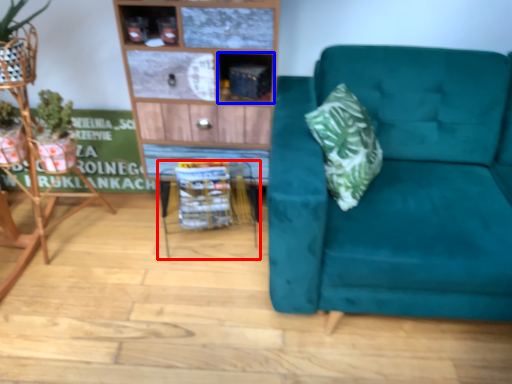
Question: Which object is further to the camera taking this photo, table (highlighted by a red box) or cabinet (highlighted by a blue box)?

Choices:
 (A) table
 (B) cabinet

Answer: (A)